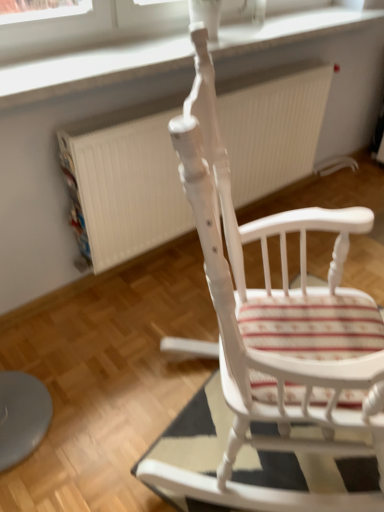
Question: Is white plastic window frame at upper center situated inside white painted wood rocking chair at center or outside?

Choices:
 (A) inside
 (B) outside

Answer: (B)

Question: Considering the relative positions of white plastic window frame at upper center and white painted wood rocking chair at center in the image provided, is white plastic window frame at upper center to the left or to the right of white painted wood rocking chair at center?

Choices:
 (A) right
 (B) left

Answer: (B)

Question: Which object is the closest to the striped fabric mat at center?

Choices:
 (A) white textured radiator at center
 (B) white painted wood rocking chair at center
 (C) white plastic window frame at upper center

Answer: (B)

Question: Which object is positioned farthest from the striped fabric mat at center?

Choices:
 (A) white plastic window frame at upper center
 (B) white painted wood rocking chair at center
 (C) white textured radiator at center

Answer: (A)